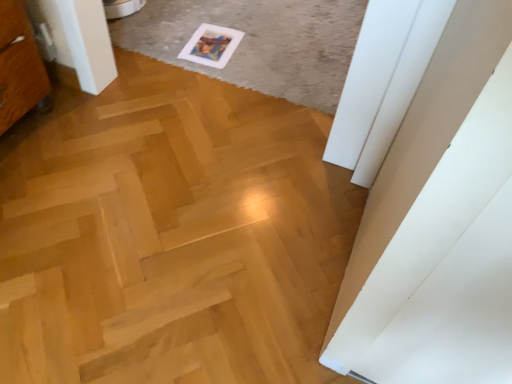
Locate an element on the screen. The image size is (512, 384). free space to the left of white paper postcard at upper center is located at coordinates (164, 31).